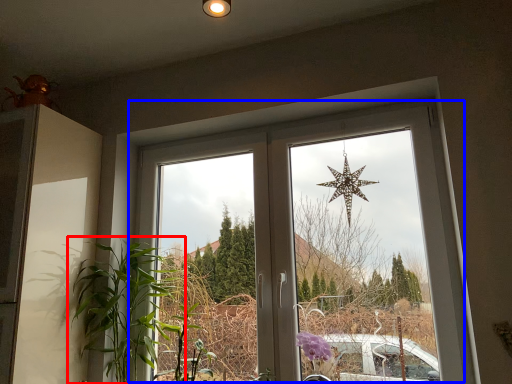
Question: Among these objects, which one is nearest to the camera, houseplant (highlighted by a red box) or window (highlighted by a blue box)?

Choices:
 (A) houseplant
 (B) window

Answer: (B)